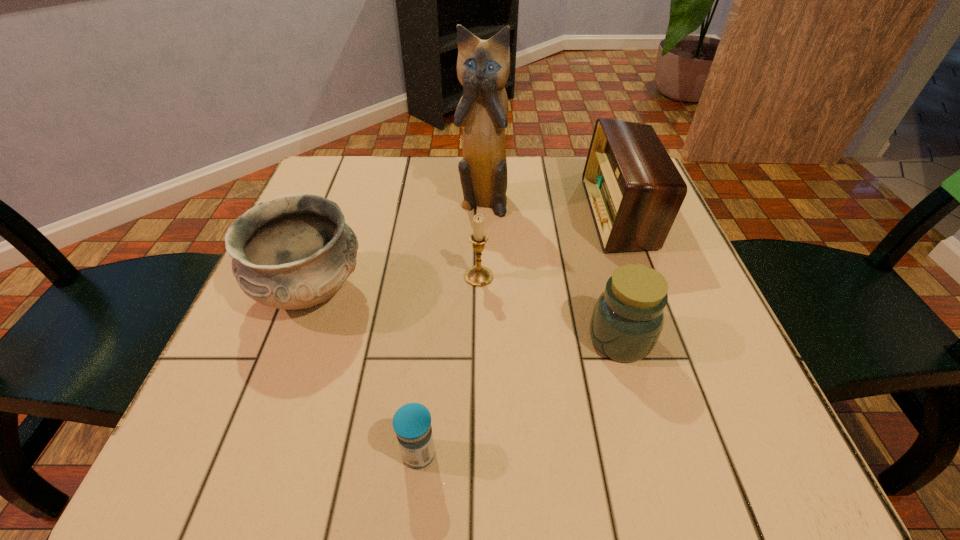
The height and width of the screenshot is (540, 960). What are the coordinates of `vacant space in between the tallest object and the radio receiver` in the screenshot? It's located at (551, 207).

Locate an element on the screen. vacant area that lies between the pottery and the candle holder is located at coordinates (395, 284).

You are a GUI agent. You are given a task and a screenshot of the screen. Output one action in this format:
    pyautogui.click(x=<x>, y=<y>)
    Task: Click on the vacant space that is in between the leftmost object and the candle holder
    The image size is (960, 540).
    Given the screenshot: What is the action you would take?
    pyautogui.click(x=395, y=284)

Where is `vacant point located between the jar and the candle holder`? The height and width of the screenshot is (540, 960). vacant point located between the jar and the candle holder is located at coordinates coord(549,308).

Locate an element on the screen. This screenshot has width=960, height=540. free space between the jar and the pottery is located at coordinates (466, 315).

This screenshot has height=540, width=960. In order to click on free space between the pottery and the candle holder in this screenshot , I will do `click(395, 284)`.

The width and height of the screenshot is (960, 540). What are the coordinates of `free point between the jar and the candle holder` in the screenshot? It's located at (549, 308).

You are a GUI agent. You are given a task and a screenshot of the screen. Output one action in this format:
    pyautogui.click(x=<x>, y=<y>)
    Task: Click on the empty location between the pottery and the jar
    
    Given the screenshot: What is the action you would take?
    pyautogui.click(x=466, y=315)

Identify which object is the third closest to the pottery. Please provide its 2D coordinates. Your answer should be formatted as a tuple, i.e. [(x, y)], where the tuple contains the x and y coordinates of a point satisfying the conditions above.

[(412, 422)]

This screenshot has height=540, width=960. Find the location of `object that ranks as the fourth closest to the candle holder`. object that ranks as the fourth closest to the candle holder is located at coordinates (634, 190).